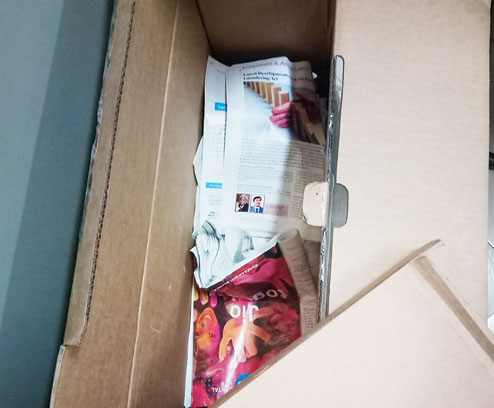
I want to click on box full of papers, so point(275,225).